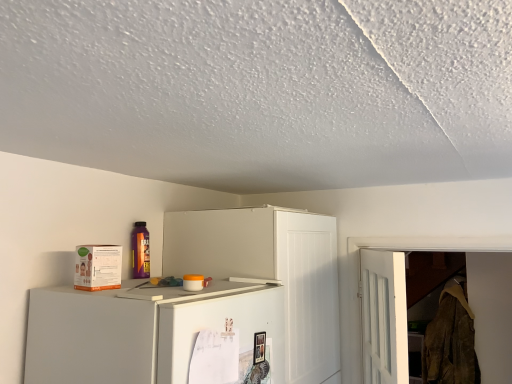
Question: Is white matte cabinet at upper center spatially inside brown textured fabric at right, or outside of it?

Choices:
 (A) outside
 (B) inside

Answer: (A)

Question: Considering the relative positions of white matte cabinet at upper center and brown textured fabric at right in the image provided, is white matte cabinet at upper center to the left or to the right of brown textured fabric at right?

Choices:
 (A) right
 (B) left

Answer: (B)

Question: From a real-world perspective, relative to brown textured fabric at right, is white matte cabinet at upper center vertically above or below?

Choices:
 (A) below
 (B) above

Answer: (B)

Question: Is brown textured fabric at right bigger or smaller than white matte cabinet at upper center?

Choices:
 (A) big
 (B) small

Answer: (B)

Question: From the image's perspective, is brown textured fabric at right located above or below white matte cabinet at upper center?

Choices:
 (A) above
 (B) below

Answer: (B)

Question: Does point (433, 327) appear closer or farther from the camera than point (243, 261)?

Choices:
 (A) closer
 (B) farther

Answer: (B)

Question: Is brown textured fabric at right wider or thinner than white matte cabinet at upper center?

Choices:
 (A) wide
 (B) thin

Answer: (B)